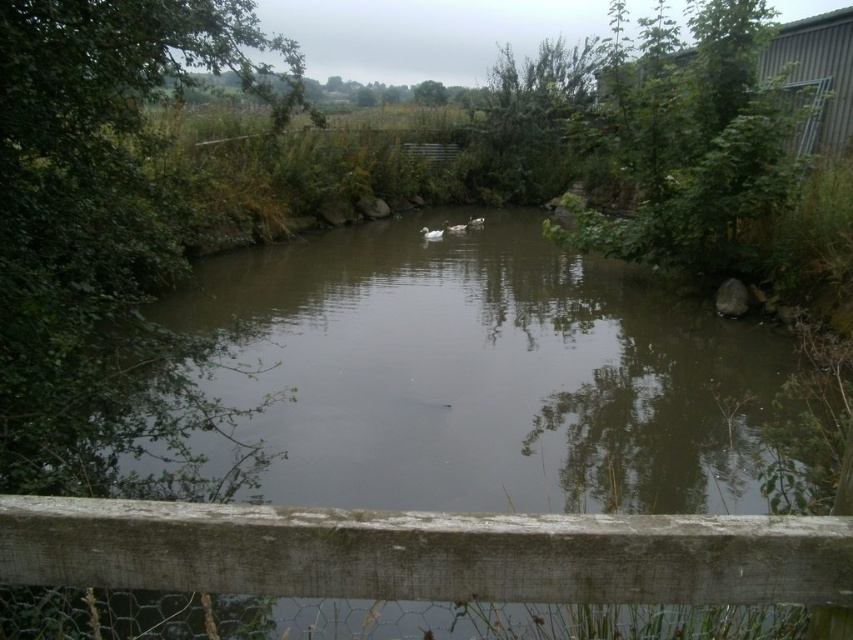
Who is more distant from viewer, (809, 586) or (431, 232)?

Positioned behind is point (431, 232).

Can you confirm if weathered wood fence at lower center is positioned to the right of white matte duck at center?

Indeed, weathered wood fence at lower center is positioned on the right side of white matte duck at center.

What are the coordinates of `weathered wood fence at lower center` in the screenshot? It's located at (425, 554).

Can you confirm if brown murky water at center is positioned below white matte duck at center?

Yes.

Is point (172, 442) closer to camera compared to point (428, 234)?

Yes, point (172, 442) is closer to viewer.

The height and width of the screenshot is (640, 853). Describe the element at coordinates (461, 380) in the screenshot. I see `brown murky water at center` at that location.

At what (x,y) coordinates should I click in order to perform the action: click on brown murky water at center. Please return your answer as a coordinate pair (x, y). Looking at the image, I should click on (461, 380).

Between brown murky water at center and weathered wood fence at lower center, which one is positioned lower?

weathered wood fence at lower center

Does brown murky water at center have a smaller size compared to weathered wood fence at lower center?

No, brown murky water at center is not smaller than weathered wood fence at lower center.

Which is in front, point (723, 499) or point (77, 502)?

Point (77, 502) is more forward.

Identify the location of brown murky water at center. (461, 380).